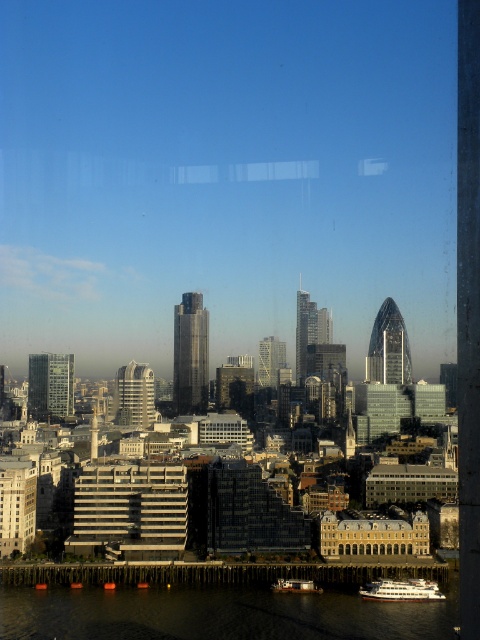
You are a dock worker who needs to park both the white glossy boat at lower right and the metallic gray boat at lower center in a storage area that can only accommodate one boat at a time. Based on their sizes, which boat should you move first to ensure they both fit?

The white glossy boat at lower right might be wider than the metallic gray boat at lower center, so you should move the metallic gray boat at lower center first to ensure both fit in the storage area.